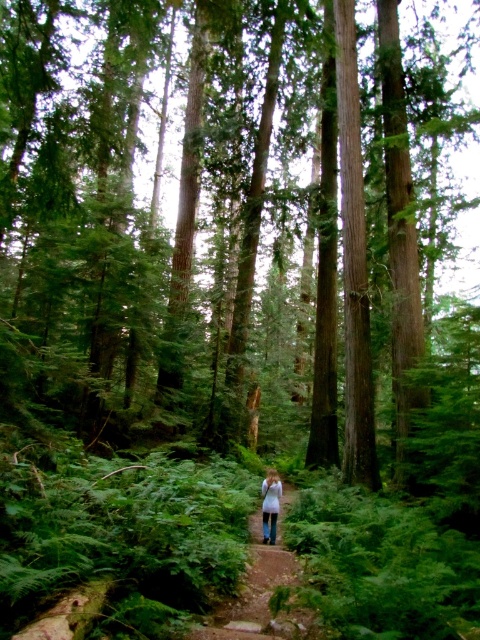
You are standing on the dirt path in the center of the forest. There is a white fabric at center. Where is the white fabric located relative to the path?

The white fabric at center is located at the point (261, 589) on the 2D plane, which is directly on the dirt path in the center of the forest.

You are standing on the narrow dirt path in the center of the forest. You see two points marked on the ground ahead of you. The first point is at coordinates point (279, 627) and the second is at point (267, 531). Which point is closer to your current position?

Point (279, 627) is closer to the camera than point (267, 531), so the first point is closer to your current position.

You are hiking on a narrow dirt path in a dense forest and notice two white items at the center of the scene. Which one is closer to you, the white fabric at center or the white cotton shirt at center?

The white fabric at center is closer to the viewer than the white cotton shirt at center.